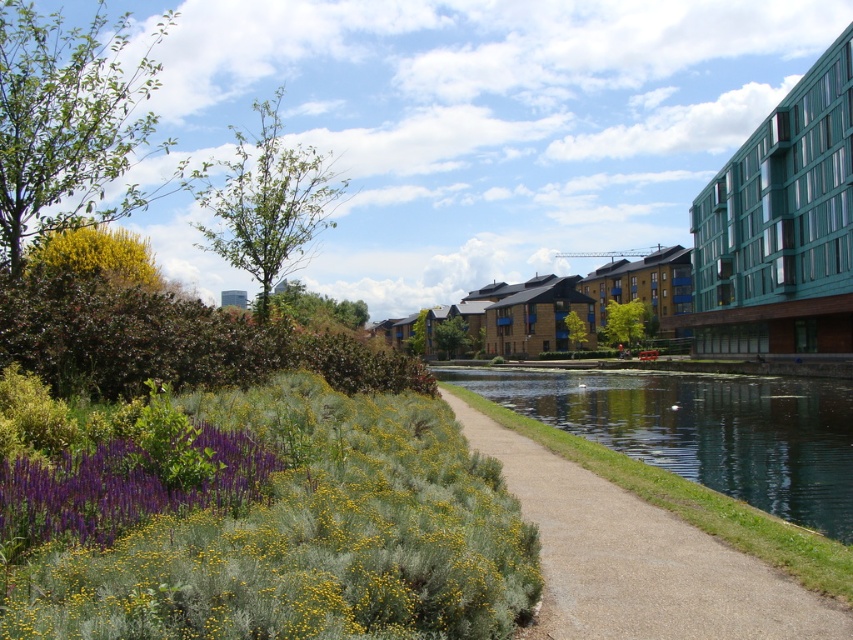
Does green fuzzy bush at lower left appear under smooth concrete path at center?

No.

Which is more to the right, green fuzzy bush at lower left or smooth concrete path at center?

smooth concrete path at center is more to the right.

Describe the element at coordinates (309, 536) in the screenshot. This screenshot has width=853, height=640. I see `green fuzzy bush at lower left` at that location.

Find the location of a particular element. green fuzzy bush at lower left is located at coordinates (309, 536).